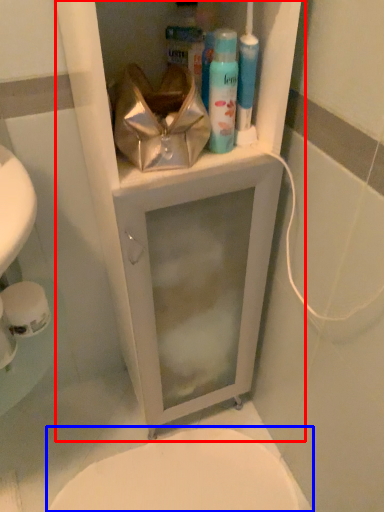
Question: Which of the following is the farthest to the observer, medicine cabinet (highlighted by a red box) or bidet (highlighted by a blue box)?

Choices:
 (A) medicine cabinet
 (B) bidet

Answer: (B)